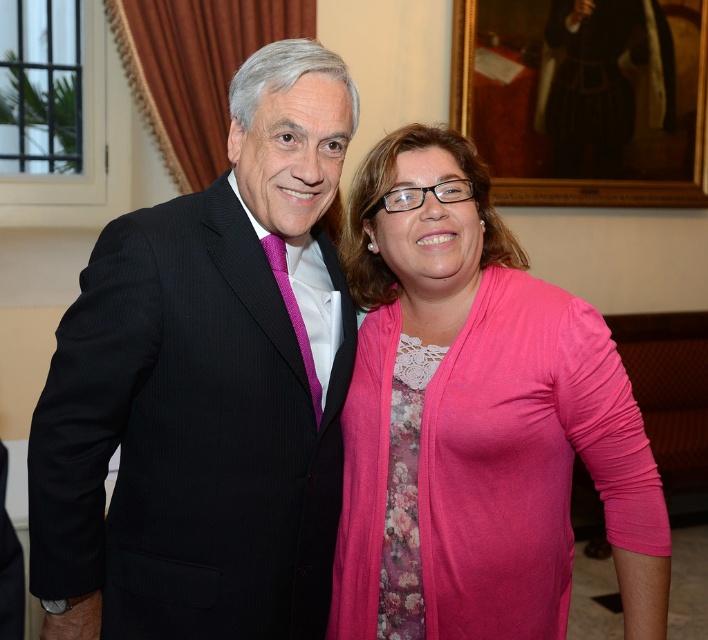
You are a photographer trying to capture a clear shot of both the black pinstripe suit at center and the pink fabric shirt at center. Since they are both at the center, which one is more in front of the other?

The black pinstripe suit at center is positioned over the pink fabric shirt at center, so it is more in front.